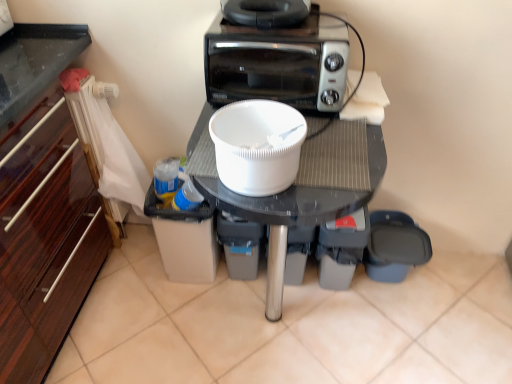
Question: Is black rubber toaster at upper center further to camera compared to white plastic table at center?

Choices:
 (A) no
 (B) yes

Answer: (B)

Question: Could you tell me if black rubber toaster at upper center is facing white plastic table at center?

Choices:
 (A) no
 (B) yes

Answer: (A)

Question: Can you confirm if black rubber toaster at upper center is thinner than white plastic table at center?

Choices:
 (A) yes
 (B) no

Answer: (A)

Question: From the image's perspective, is black rubber toaster at upper center under white plastic table at center?

Choices:
 (A) no
 (B) yes

Answer: (A)

Question: Considering the relative positions of black rubber toaster at upper center and white plastic table at center in the image provided, is black rubber toaster at upper center in front of white plastic table at center?

Choices:
 (A) yes
 (B) no

Answer: (B)

Question: Is black rubber toaster at upper center shorter than white plastic table at center?

Choices:
 (A) no
 (B) yes

Answer: (B)

Question: Does white plastic table at center appear on the left side of black rubber toaster at upper center?

Choices:
 (A) yes
 (B) no

Answer: (B)

Question: Does white plastic table at center have a larger size compared to black rubber toaster at upper center?

Choices:
 (A) yes
 (B) no

Answer: (A)

Question: Can you confirm if white plastic table at center is wider than black rubber toaster at upper center?

Choices:
 (A) yes
 (B) no

Answer: (A)

Question: Does white plastic table at center have a smaller size compared to black rubber toaster at upper center?

Choices:
 (A) no
 (B) yes

Answer: (A)

Question: Is white plastic table at center looking in the opposite direction of black rubber toaster at upper center?

Choices:
 (A) yes
 (B) no

Answer: (B)

Question: Is white plastic table at center positioned far away from black rubber toaster at upper center?

Choices:
 (A) no
 (B) yes

Answer: (A)

Question: Does black plastic toaster at upper center have a larger size compared to white plastic table at center?

Choices:
 (A) no
 (B) yes

Answer: (A)